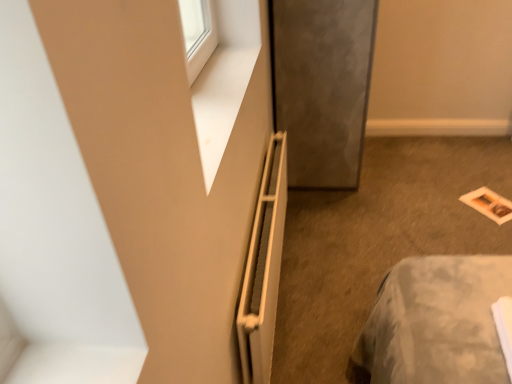
Question: Could you tell me if white matte radiator at center is facing matte gray screen door at center?

Choices:
 (A) no
 (B) yes

Answer: (A)

Question: Does white matte radiator at center have a larger size compared to matte gray screen door at center?

Choices:
 (A) no
 (B) yes

Answer: (A)

Question: Is white matte radiator at center at the left side of matte gray screen door at center?

Choices:
 (A) no
 (B) yes

Answer: (B)

Question: Can we say white matte radiator at center lies outside matte gray screen door at center?

Choices:
 (A) yes
 (B) no

Answer: (A)

Question: Considering the relative positions of white matte radiator at center and matte gray screen door at center in the image provided, is white matte radiator at center to the right of matte gray screen door at center from the viewer's perspective?

Choices:
 (A) no
 (B) yes

Answer: (A)

Question: Can you confirm if white matte radiator at center is taller than matte gray screen door at center?

Choices:
 (A) yes
 (B) no

Answer: (B)

Question: Could white matte radiator at center be considered to be inside matte paper magazine at lower right?

Choices:
 (A) no
 (B) yes

Answer: (A)

Question: Is matte paper magazine at lower right directly adjacent to white matte radiator at center?

Choices:
 (A) yes
 (B) no

Answer: (B)

Question: Is matte paper magazine at lower right to the left of white matte radiator at center from the viewer's perspective?

Choices:
 (A) no
 (B) yes

Answer: (A)

Question: Is matte paper magazine at lower right shorter than white matte radiator at center?

Choices:
 (A) no
 (B) yes

Answer: (B)

Question: Is matte paper magazine at lower right bigger than white matte radiator at center?

Choices:
 (A) no
 (B) yes

Answer: (A)

Question: Can you confirm if matte paper magazine at lower right is positioned to the right of white matte radiator at center?

Choices:
 (A) no
 (B) yes

Answer: (B)

Question: From a real-world perspective, is matte paper magazine at lower right over matte gray screen door at center?

Choices:
 (A) yes
 (B) no

Answer: (B)